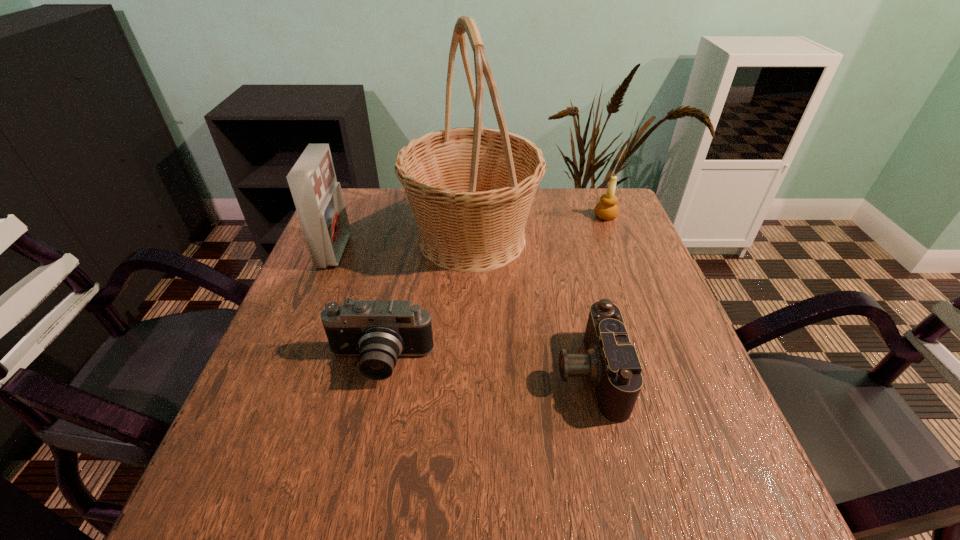
This screenshot has width=960, height=540. Identify the location of free space that is in between the rightmost object and the shortest object. (597, 295).

The height and width of the screenshot is (540, 960). Identify the location of vacant space in between the basket and the shortest object. (530, 306).

At what (x,y) coordinates should I click in order to perform the action: click on free space between the shorter camera and the first-aid kit. Please return your answer as a coordinate pair (x, y). Looking at the image, I should click on (462, 312).

The width and height of the screenshot is (960, 540). I want to click on empty space that is in between the tallest object and the candle_holder, so click(539, 227).

Locate an element on the screen. The height and width of the screenshot is (540, 960). vacant space in between the candle_holder and the left camera is located at coordinates (492, 289).

Find the location of a particular element. This screenshot has height=540, width=960. free spot between the taller camera and the shorter camera is located at coordinates (485, 368).

The width and height of the screenshot is (960, 540). In order to click on blank region between the tallest object and the candle_holder in this screenshot , I will do `click(539, 227)`.

Where is `object that is the fourth closest one to the taller camera`? object that is the fourth closest one to the taller camera is located at coordinates (607, 209).

You are a GUI agent. You are given a task and a screenshot of the screen. Output one action in this format:
    pyautogui.click(x=<x>, y=<y>)
    Task: Click on the object that is the closest to the taller camera
    This screenshot has width=960, height=540.
    Given the screenshot: What is the action you would take?
    pyautogui.click(x=470, y=189)

The height and width of the screenshot is (540, 960). I want to click on free space that satisfies the following two spatial constraints: 1. on the back side of the rightmost object; 2. on the right side of the basket, so click(x=472, y=216).